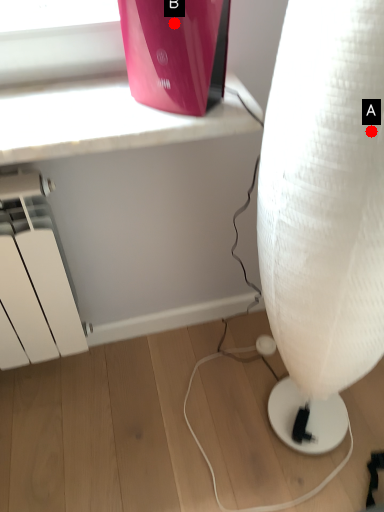
Question: Two points are circled on the image, labeled by A and B beside each circle. Which point is closer to the camera?

Choices:
 (A) A is closer
 (B) B is closer

Answer: (A)